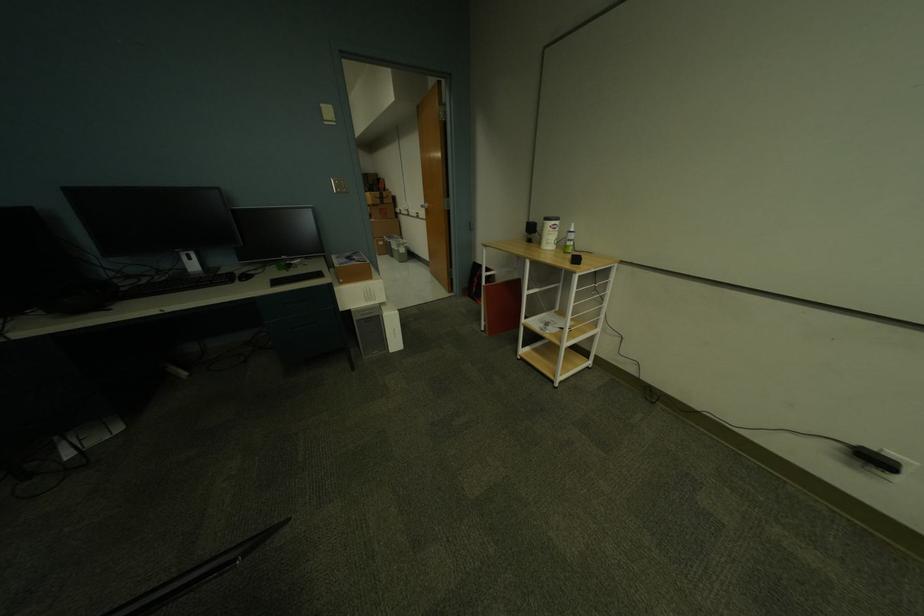
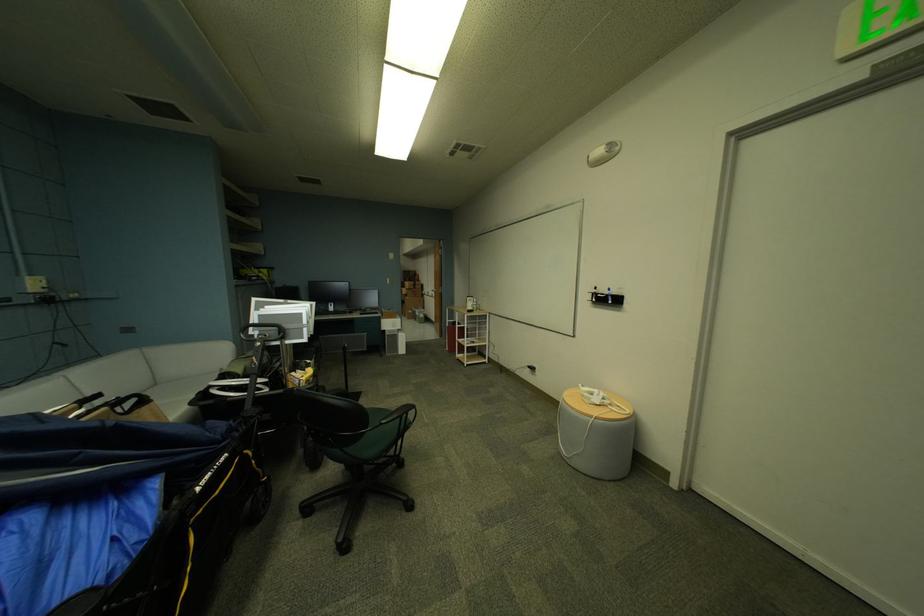
Where in the second image is the point corresponding to point 359,313 from the first image?

(393, 331)